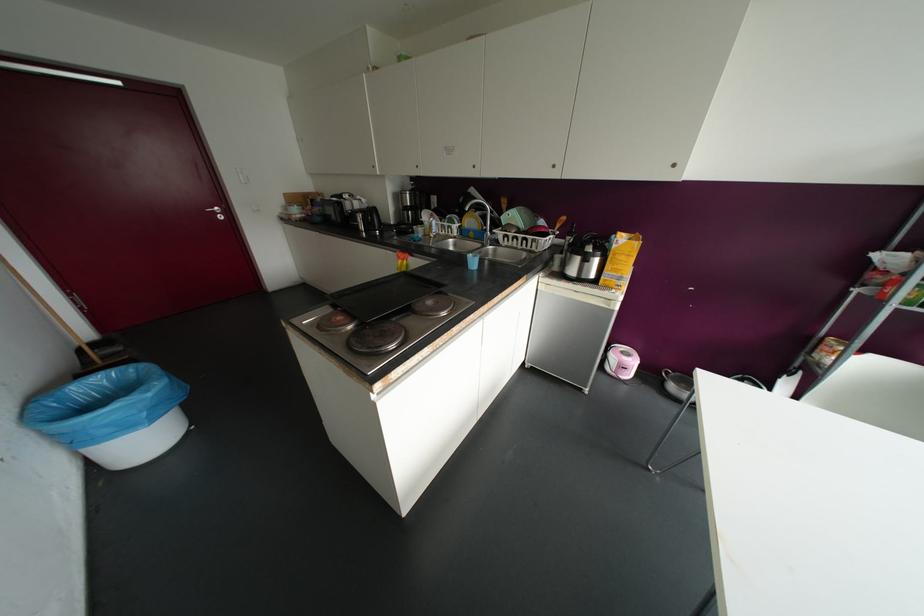
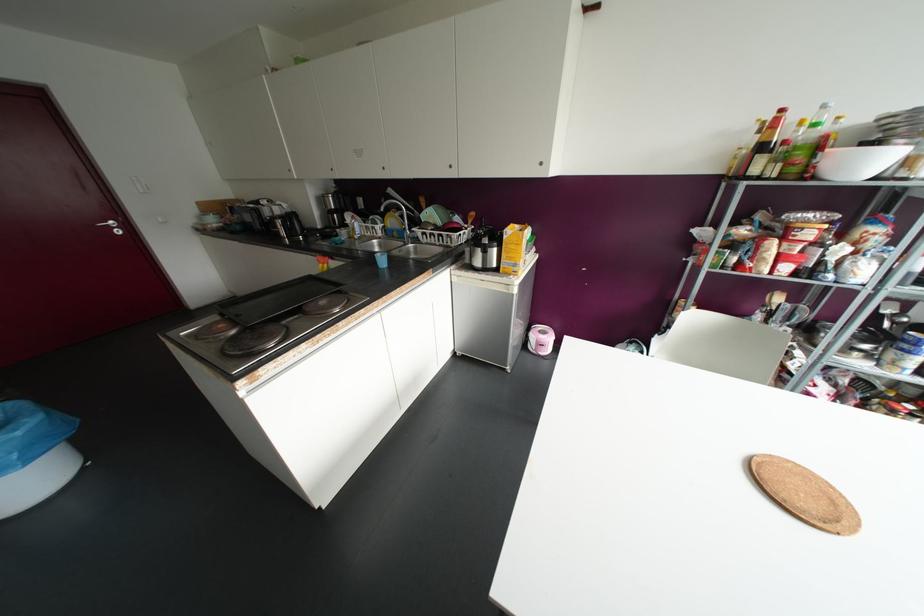
The point at (220, 217) is marked in the first image. Where is the corresponding point in the second image?

(117, 232)